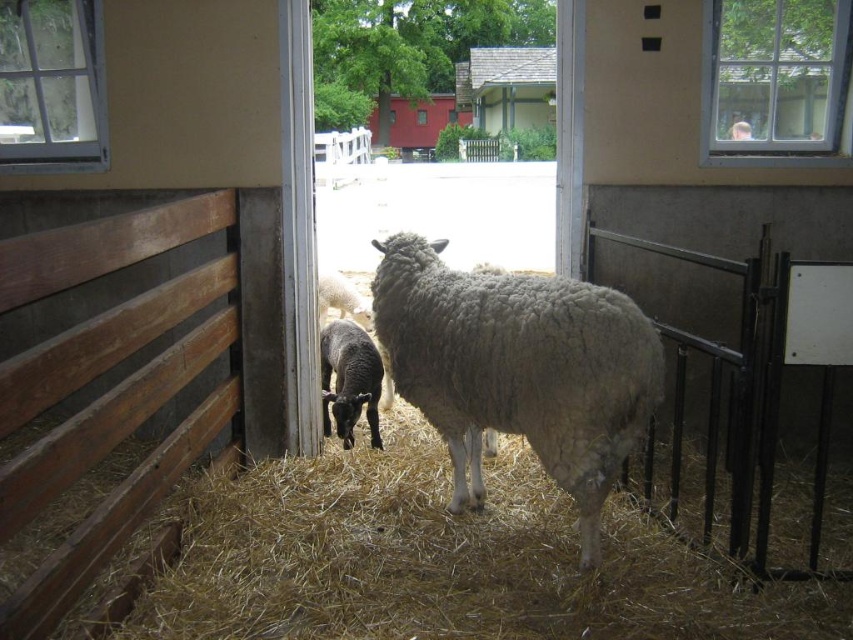
Is light brown straw at center shorter than white woolen lamb at center?

Yes.

Is light brown straw at center behind white woolen lamb at center?

No, it is in front of white woolen lamb at center.

What do you see at coordinates (444, 561) in the screenshot?
I see `light brown straw at center` at bounding box center [444, 561].

I want to click on light brown straw at center, so click(x=444, y=561).

Is black woolly lamb at center smaller than white woolen lamb at center?

No, black woolly lamb at center is not smaller than white woolen lamb at center.

Is black woolly lamb at center above white woolen lamb at center?

No, black woolly lamb at center is not above white woolen lamb at center.

This screenshot has height=640, width=853. Describe the element at coordinates (349, 380) in the screenshot. I see `black woolly lamb at center` at that location.

Find the location of `black woolly lamb at center`. black woolly lamb at center is located at coordinates (349, 380).

Is fuzzy woolly sheep at center smaller than smooth plastic cup at upper right?

No.

Can you confirm if fuzzy woolly sheep at center is positioned to the right of smooth plastic cup at upper right?

In fact, fuzzy woolly sheep at center is to the left of smooth plastic cup at upper right.

Find the location of a particular element. fuzzy woolly sheep at center is located at coordinates (519, 369).